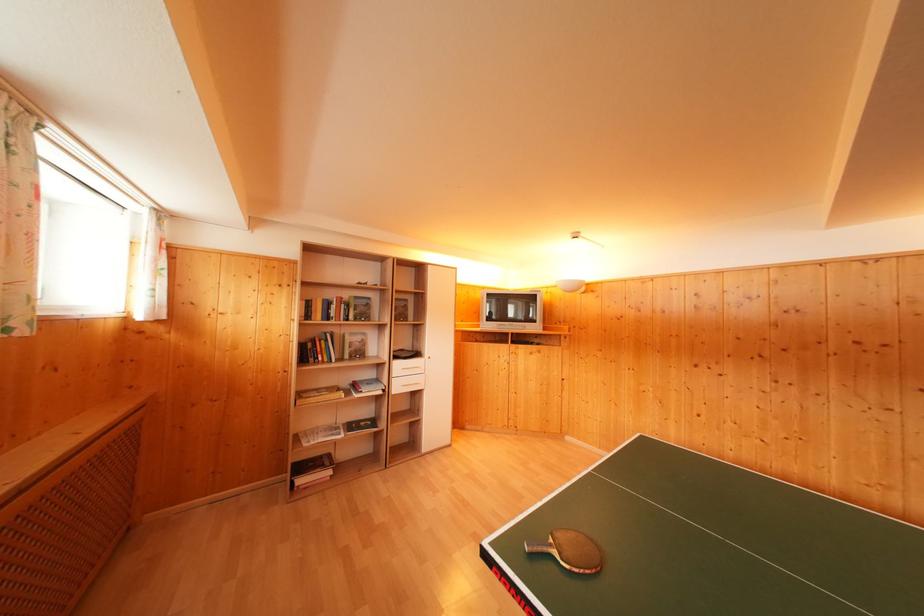
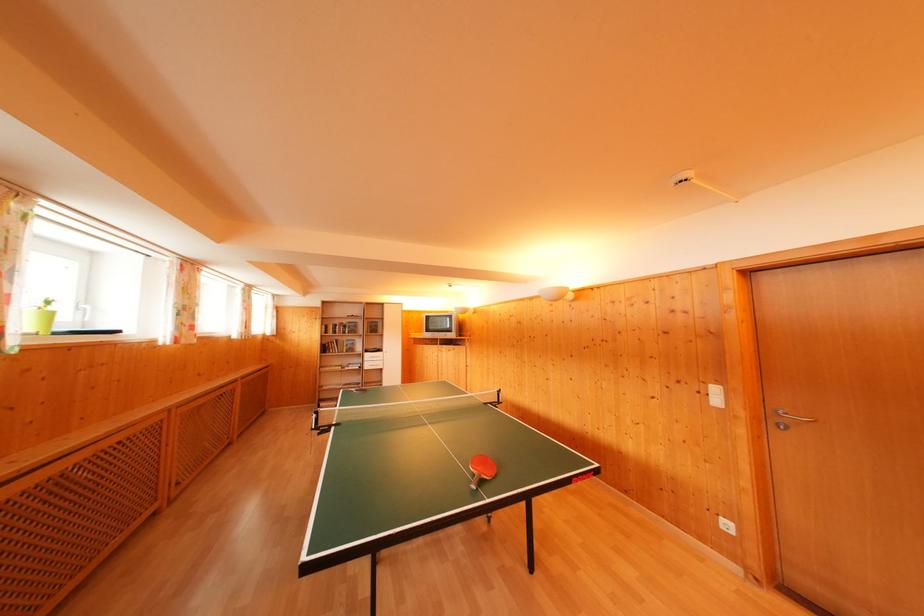
In the second image, find the point that corresponds to (306,331) in the first image.

(326, 342)